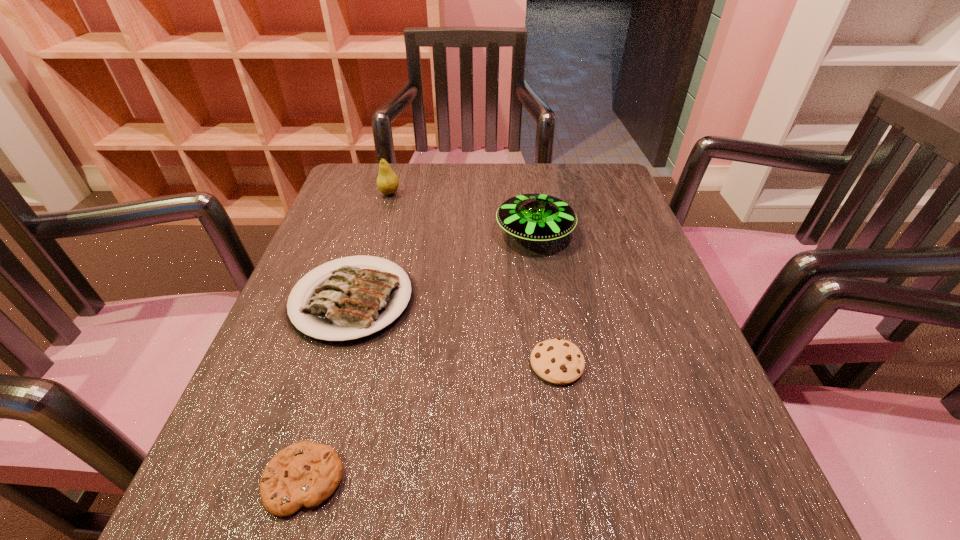
The height and width of the screenshot is (540, 960). Find the location of `object located in the near left corner section of the desktop`. object located in the near left corner section of the desktop is located at coordinates (306, 473).

Locate an element on the screen. This screenshot has height=540, width=960. object situated at the far right corner is located at coordinates (534, 217).

I want to click on free space at the far edge of the desktop, so click(x=428, y=193).

At what (x,y) coordinates should I click in order to perform the action: click on vacant area at the near edge of the desktop. Please return your answer as a coordinate pair (x, y). This screenshot has width=960, height=540. Looking at the image, I should click on point(461,503).

Locate an element on the screen. This screenshot has height=540, width=960. vacant area at the left edge is located at coordinates pyautogui.click(x=312, y=367).

Locate an element on the screen. The image size is (960, 540). free space at the right edge of the desktop is located at coordinates (641, 226).

Image resolution: width=960 pixels, height=540 pixels. In the image, there is a desktop. What are the coordinates of `blank space at the far left corner` in the screenshot? It's located at (352, 184).

In the image, there is a desktop. At what (x,y) coordinates should I click in order to perform the action: click on vacant space at the near right corner. Please return your answer as a coordinate pair (x, y). Looking at the image, I should click on (693, 505).

At what (x,y) coordinates should I click in order to perform the action: click on empty space between the nearest object and the second tallest object. Please return your answer as a coordinate pair (x, y). The image size is (960, 540). Looking at the image, I should click on (420, 356).

This screenshot has width=960, height=540. Identify the location of free space between the saucer and the left cookie. (420, 356).